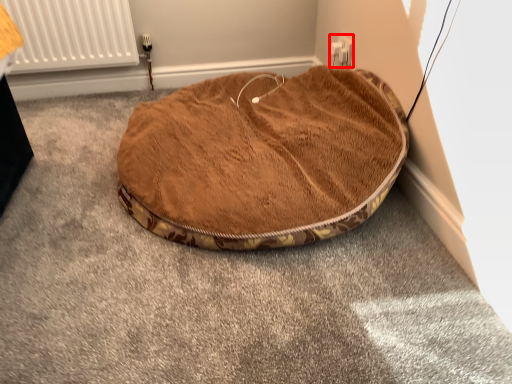
Question: In this image, where is electric outlet (annotated by the red box) located relative to dog bed?

Choices:
 (A) left
 (B) right

Answer: (B)